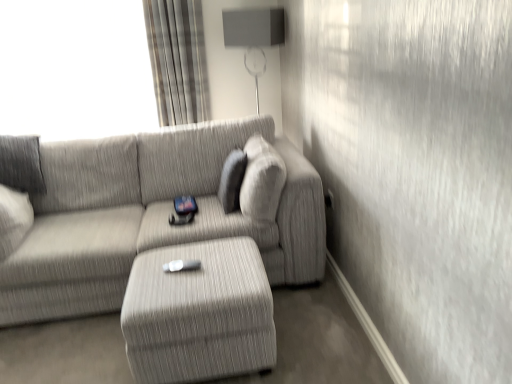
Locate an element on the screen. Image resolution: width=512 pixels, height=384 pixels. free point above textured gray ottoman at center (from a real-world perspective) is located at coordinates (192, 258).